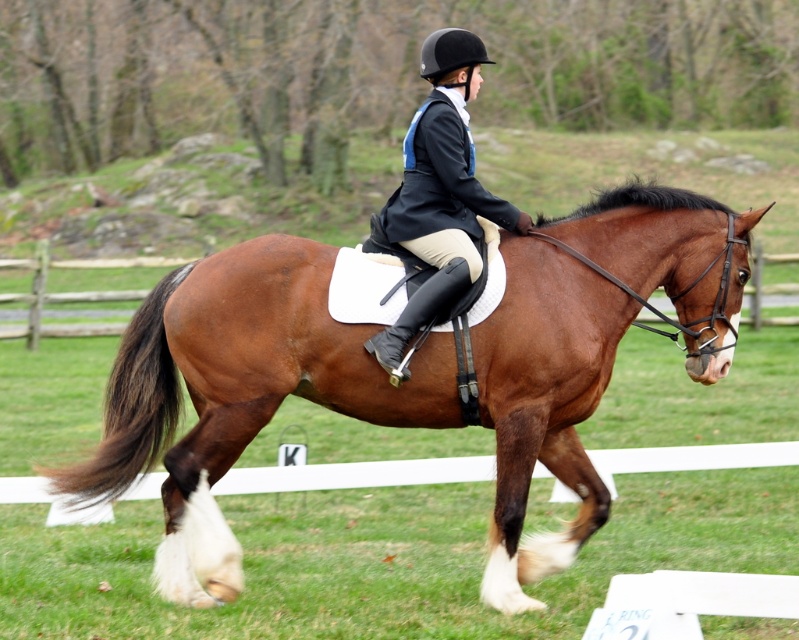
You are standing in the equestrian arena and want to place a small decorative flag at point (567, 449). If you have a flag that needs to be placed exactly 25 feet away from where you are standing, will this point be suitable?

The distance of point (567, 449) from viewer is 24.63 feet, which is slightly less than 25 feet. Therefore, this point is not suitable for placing the flag as it is 0.37 feet closer than required.

You are a photographer positioned at the edge of the arena. You want to capture a photo of the brown glossy horse at center and the brown silky tail at lower left. Which object should you focus on first if you want to ensure both are in sharp focus?

The brown glossy horse at center is much taller than the brown silky tail at lower left, so focusing on the horse first would help ensure both are in sharp focus as the tail is closer to the camera.

You are a photographer trying to capture the brown glossy horse at center and the brown silky tail at lower left in a single frame. Considering the camera you have can only focus on objects within a 1.5 meter width, will both objects fit in the frame?

The brown glossy horse at center is wider than the brown silky tail at lower left. Since the camera can only focus on objects within a 1.5 meter width, and the horse is wider than the tail, it depends on the actual width of the horse. If the horse is wider than 1.5 meters, then both might not fit. However, the description only states the horse is larger in width than the tail, but not the exact measurements. Without knowing the exact width of the horse, we cannot definitively answer if both will fit.